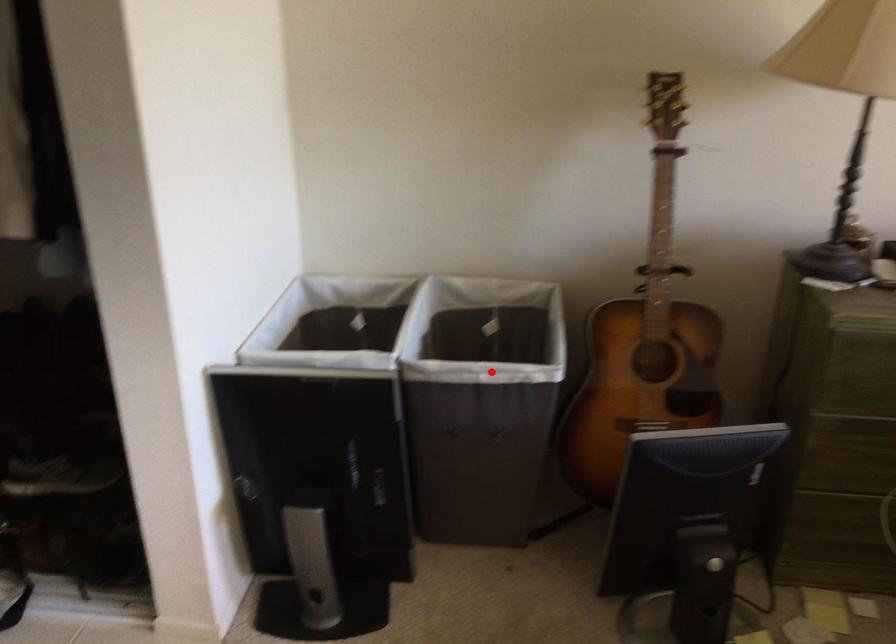
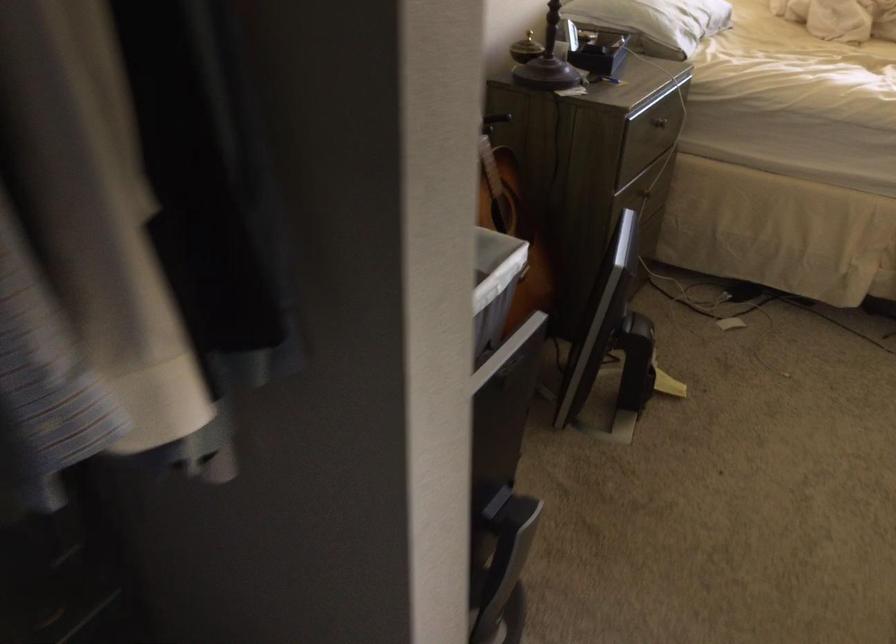
The point at the highlighted location is marked in the first image. Where is the corresponding point in the second image?

(494, 286)